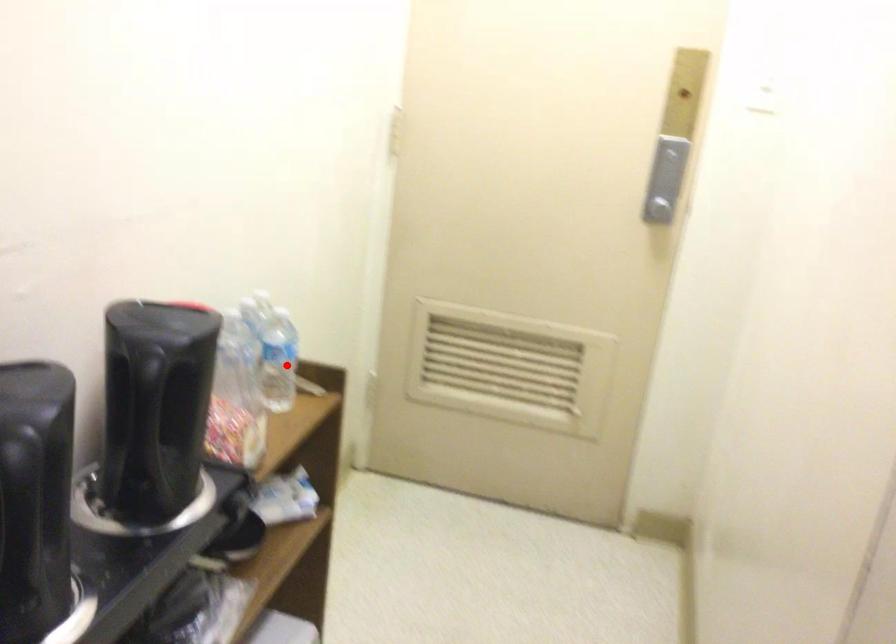
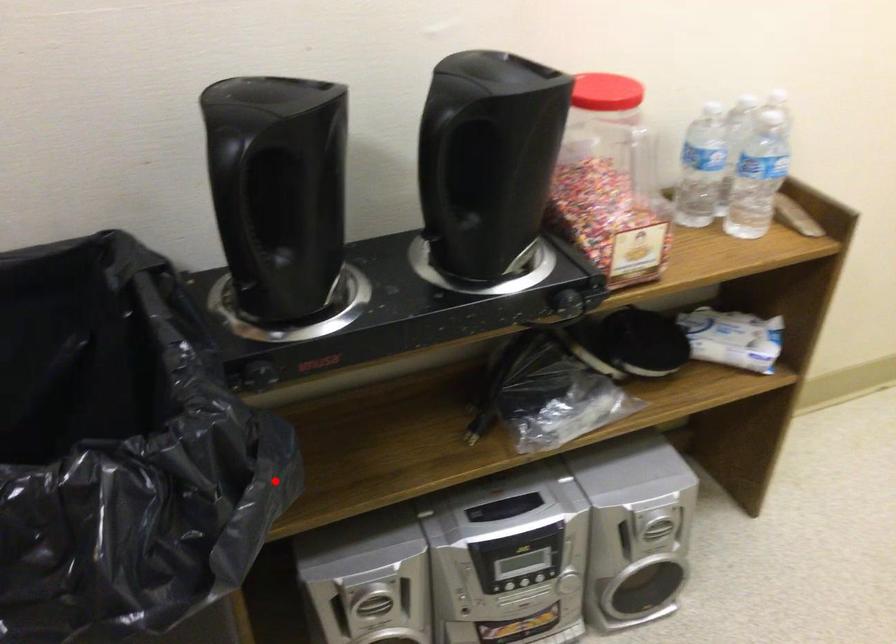
I am providing you with two images of the same scene from different viewpoints. A red point is marked on the first image and another point is marked on the second image. Is the marked point in image1 the same physical position as the marked point in image2?

No